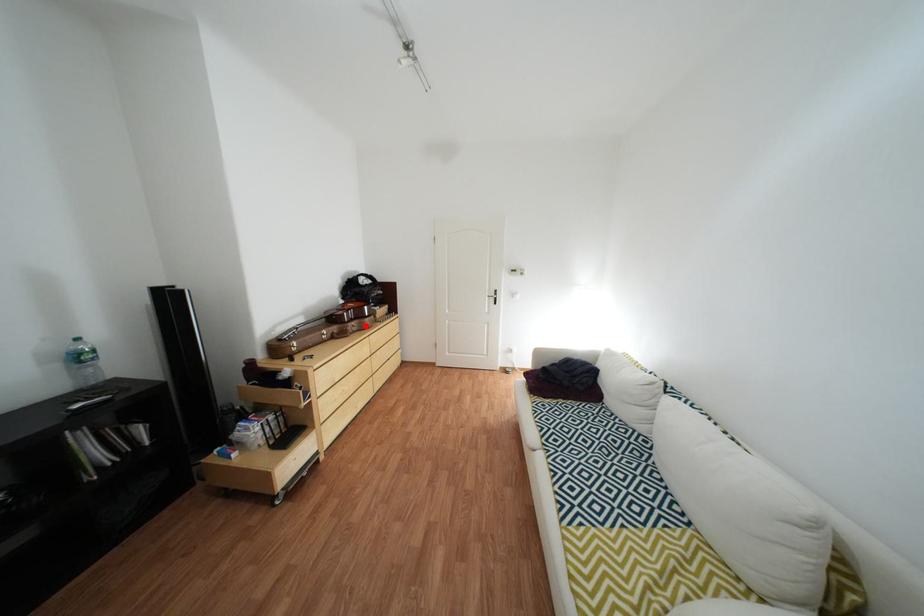
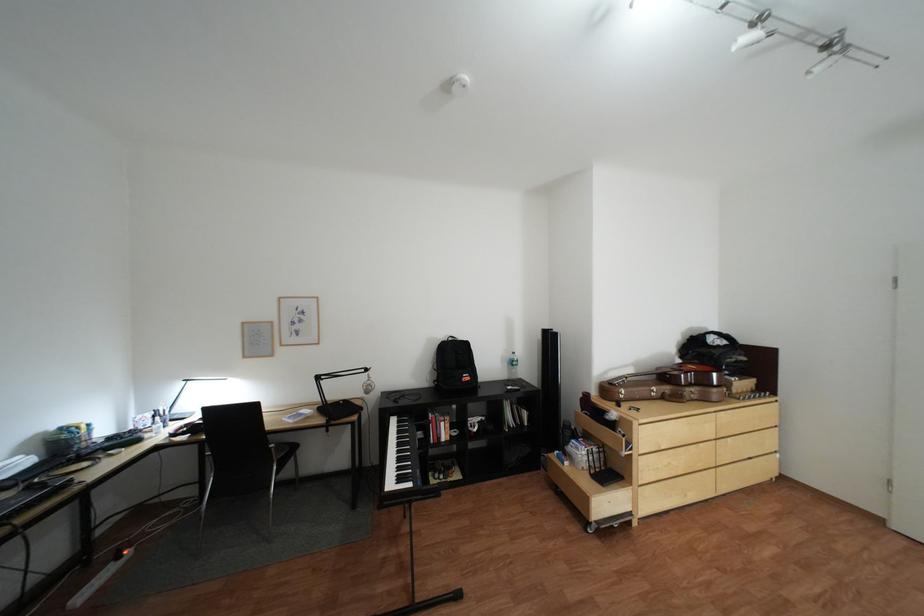
Where in the second image is the point corresponding to the highlighted location from the first image?

(703, 391)